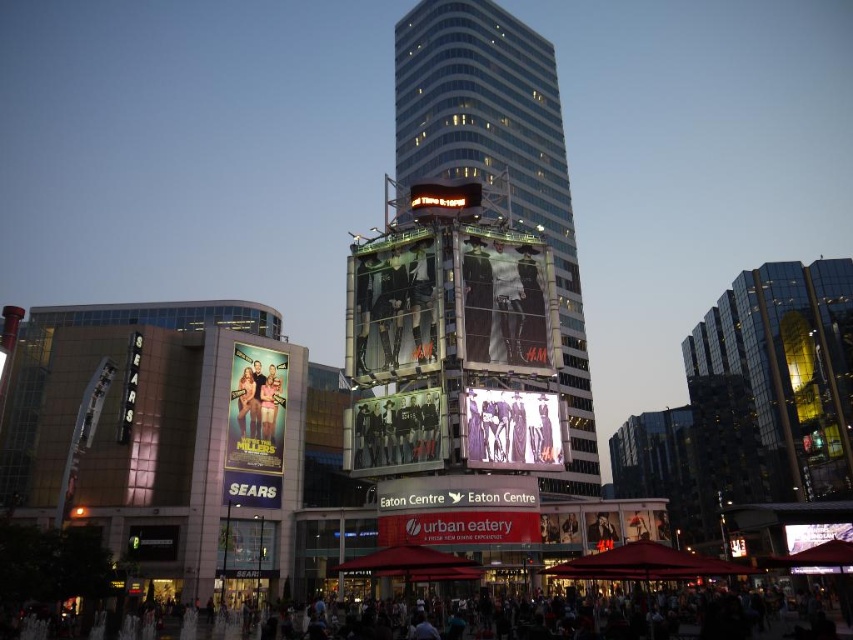
Consider the image. Who is taller, metallic silver billboard at center or metallic gold billboard at center?

metallic gold billboard at center is taller.

Who is lower down, metallic silver billboard at center or metallic gold billboard at center?

metallic silver billboard at center is below.

Locate an element on the screen. The width and height of the screenshot is (853, 640). metallic silver billboard at center is located at coordinates (397, 433).

Does matte purple dress at center appear over smooth black jacket at center?

Yes.

Is matte purple dress at center to the left of smooth black jacket at center from the viewer's perspective?

Indeed, matte purple dress at center is positioned on the left side of smooth black jacket at center.

At what (x,y) coordinates should I click in order to perform the action: click on matte purple dress at center. Please return your answer as a coordinate pair (x, y). Looking at the image, I should click on (512, 429).

Who is positioned more to the left, glassy reflective tower at center or metallic silver billboard at center?

metallic silver billboard at center

Is point (531, 218) in front of point (434, 397)?

No.

Does point (399, 93) lie behind point (387, 464)?

Yes.

At what (x,y) coordinates should I click in order to perform the action: click on glassy reflective tower at center. Please return your answer as a coordinate pair (x, y). The image size is (853, 640). Looking at the image, I should click on (498, 157).